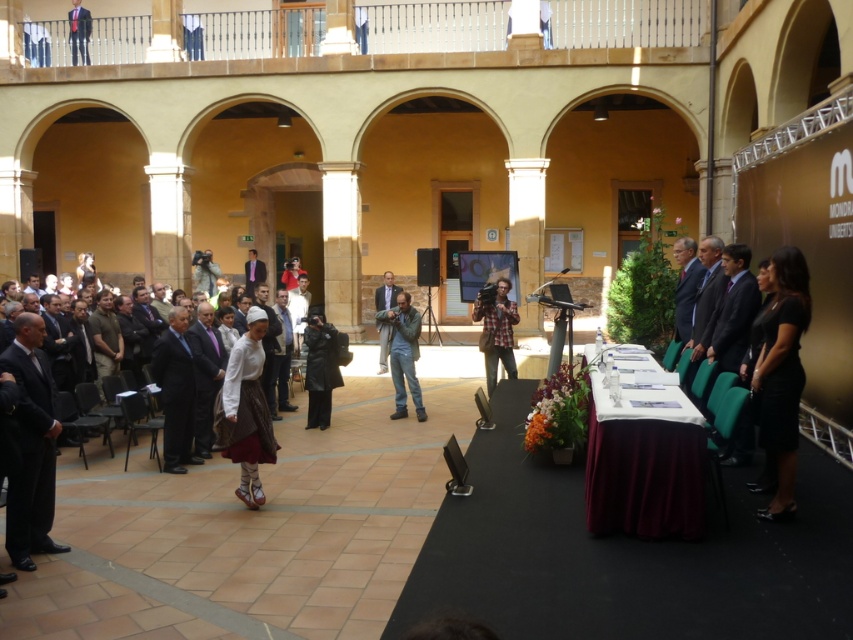
Question: Which point is closer to the camera?

Choices:
 (A) (392, 300)
 (B) (500, 330)
 (C) (190, 17)

Answer: (B)

Question: Which object appears farthest from the camera in this image?

Choices:
 (A) black suit at left
 (B) matte black suit at upper center
 (C) dark gray suit at center

Answer: (B)

Question: Considering the real-world distances, which object is closest to the black suit at left?

Choices:
 (A) leather jacket at center
 (B) plaid fabric camera at center
 (C) matte black suit at upper center
 (D) dark blue suit at upper left

Answer: (A)

Question: Does black suit at left have a smaller size compared to matte black camera at center?

Choices:
 (A) yes
 (B) no

Answer: (B)

Question: Is velvet burgundy table at center wider than plaid fabric camera at center?

Choices:
 (A) yes
 (B) no

Answer: (A)

Question: Can you confirm if black satin dress at lower right is positioned to the left of leather jacket at center?

Choices:
 (A) yes
 (B) no

Answer: (B)